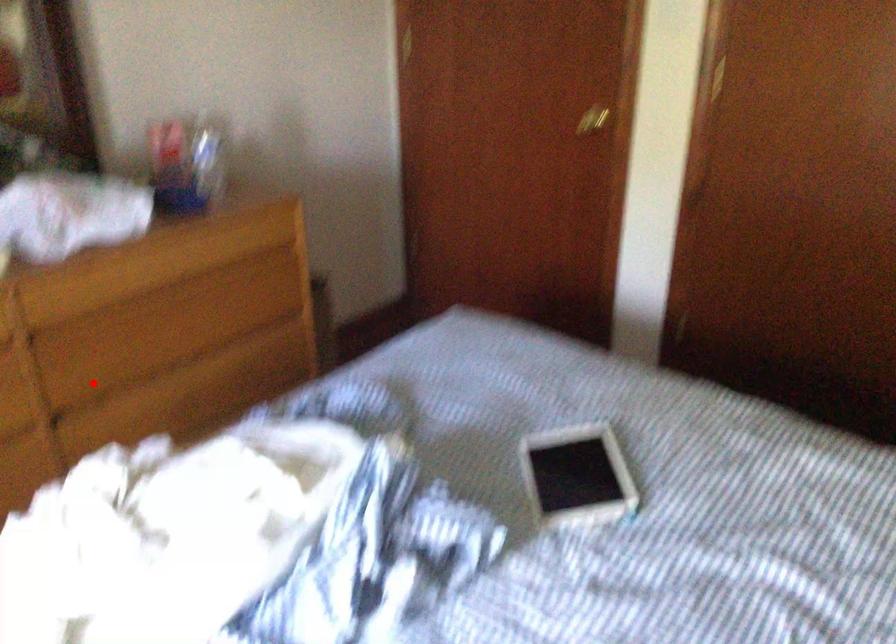
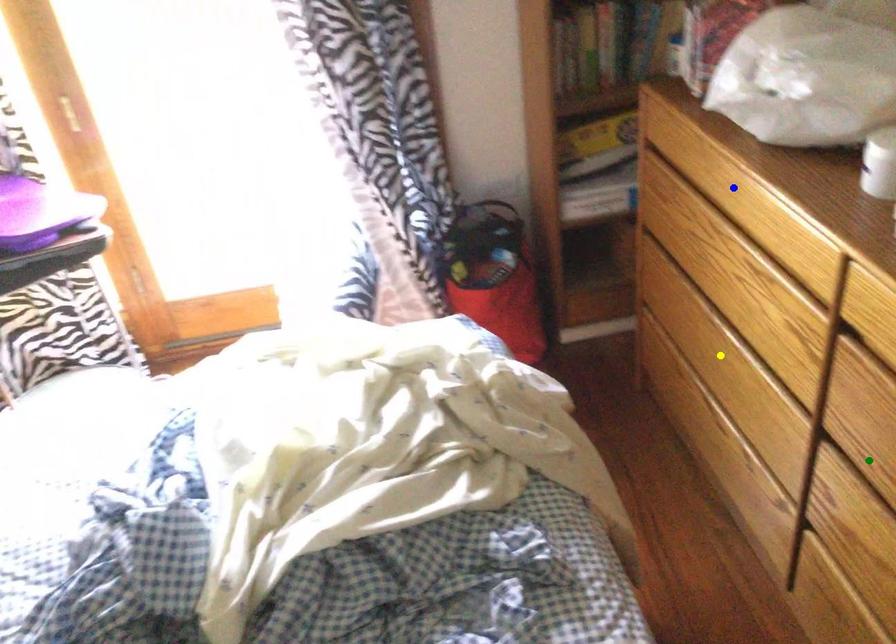
Question: I am providing you with two images of the same scene from different viewpoints. A red point is marked on the first image. You are given multiple points on the second image. Can you choose the point in image 2 that corresponds to the point in image 1?

Choices:
 (A) green point
 (B) blue point
 (C) yellow point

Answer: (A)